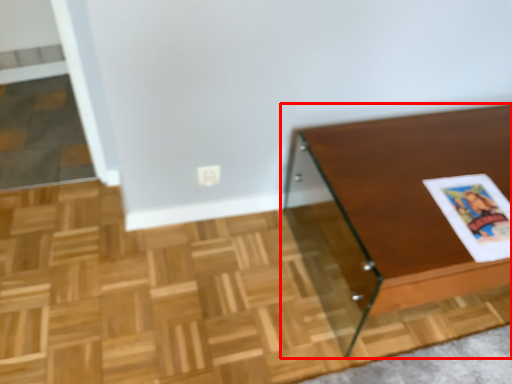
Question: From the image's perspective, where is table (annotated by the red box) located relative to magazine?

Choices:
 (A) below
 (B) above

Answer: (A)